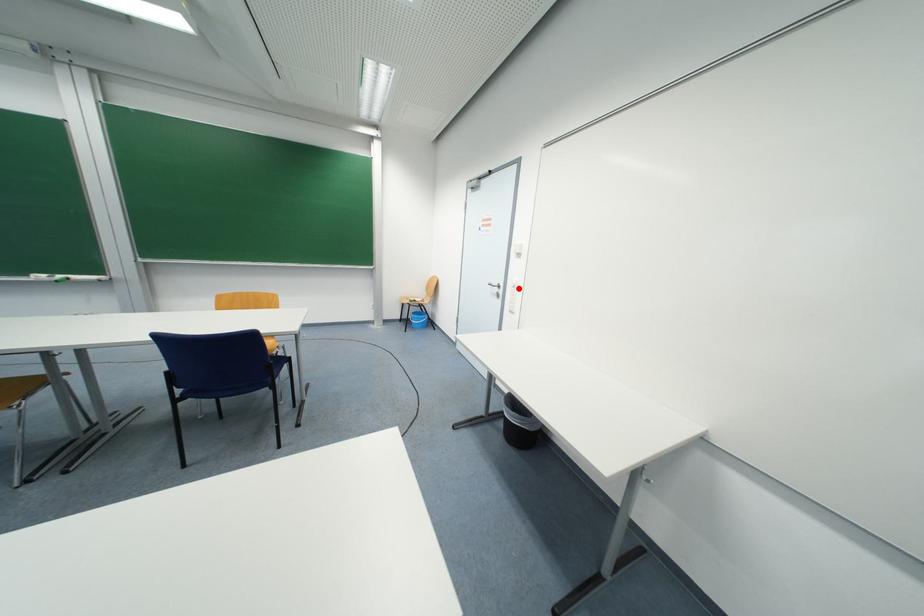
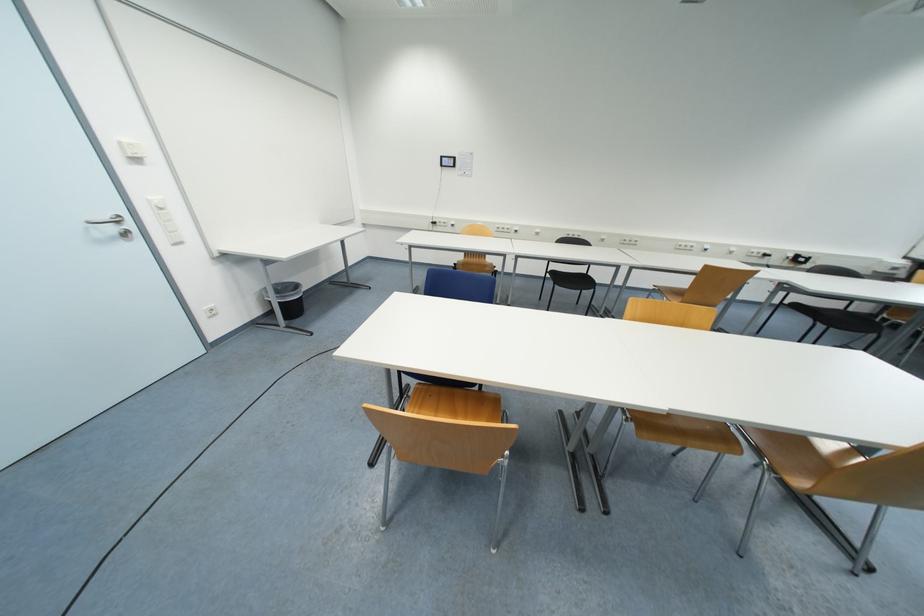
In the second image, find the point that corresponds to the highlighted location in the first image.

(166, 211)